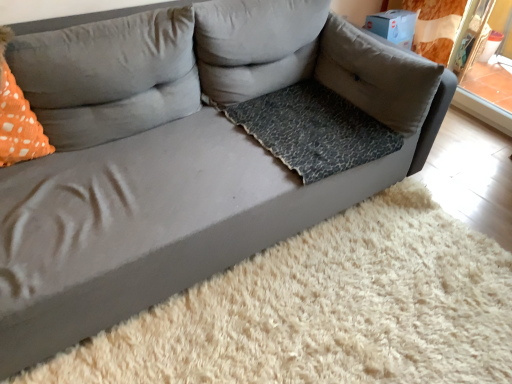
Question: From a real-world perspective, is orange dotted fabric at left positioned over gray fabric pillow at center, which is the 2th pillow in left-to-right order, based on gravity?

Choices:
 (A) no
 (B) yes

Answer: (A)

Question: Would you consider orange dotted fabric at left to be distant from gray fabric pillow at center, which is the 2th pillow in left-to-right order?

Choices:
 (A) yes
 (B) no

Answer: (B)

Question: Can you confirm if orange dotted fabric at left is positioned to the right of gray fabric pillow at center, which is the 2th pillow in left-to-right order?

Choices:
 (A) no
 (B) yes

Answer: (A)

Question: Is orange dotted fabric at left positioned with its back to gray fabric pillow at center, which is the 2th pillow in left-to-right order?

Choices:
 (A) yes
 (B) no

Answer: (B)

Question: Would you say orange dotted fabric at left is outside gray fabric pillow at center, which is the 2th pillow in left-to-right order?

Choices:
 (A) yes
 (B) no

Answer: (A)

Question: From the image's perspective, is orange dotted fabric at left on top of gray fabric pillow at center, which is the 2th pillow in left-to-right order?

Choices:
 (A) no
 (B) yes

Answer: (A)

Question: Is orange dotted pillow at left, acting as the 3th pillow starting from the right, shorter than leopard print fabric dog bed at center?

Choices:
 (A) no
 (B) yes

Answer: (A)

Question: Considering the relative sizes of orange dotted pillow at left, acting as the 3th pillow starting from the right, and leopard print fabric dog bed at center in the image provided, is orange dotted pillow at left, acting as the 3th pillow starting from the right, wider than leopard print fabric dog bed at center?

Choices:
 (A) no
 (B) yes

Answer: (A)

Question: Can you confirm if orange dotted pillow at left, acting as the 3th pillow starting from the right, is bigger than leopard print fabric dog bed at center?

Choices:
 (A) no
 (B) yes

Answer: (B)

Question: Is the depth of orange dotted pillow at left, acting as the 3th pillow starting from the right, greater than that of leopard print fabric dog bed at center?

Choices:
 (A) no
 (B) yes

Answer: (A)

Question: Is orange dotted pillow at left, acting as the 3th pillow starting from the right, facing away from leopard print fabric dog bed at center?

Choices:
 (A) yes
 (B) no

Answer: (B)

Question: From the image's perspective, is orange dotted pillow at left, the first pillow from the left, on leopard print fabric dog bed at center?

Choices:
 (A) yes
 (B) no

Answer: (A)

Question: Can you confirm if gray fabric pillow at upper right, the third pillow viewed from the left, is taller than gray fabric pillow at center, which is the second pillow in right-to-left order?

Choices:
 (A) yes
 (B) no

Answer: (B)